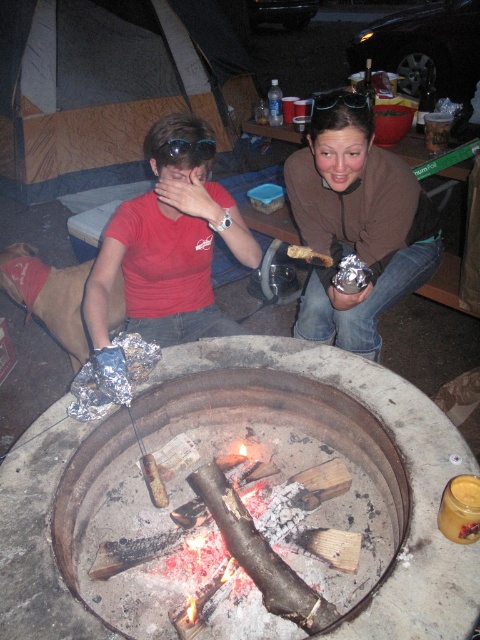
Question: Can you confirm if matte red shirt at center is positioned to the right of black plastic goggles at upper center?

Choices:
 (A) yes
 (B) no

Answer: (A)

Question: Is charcoal gray concrete fire pit at center above black fabric tent at upper left?

Choices:
 (A) no
 (B) yes

Answer: (A)

Question: Based on their relative distances, which object is farther from the black plastic goggles at upper center?

Choices:
 (A) matte brown sweater at center
 (B) matte red shirt at left
 (C) black fabric tent at upper left
 (D) charcoal gray concrete fire pit at center

Answer: (C)

Question: Which point is farther to the camera?

Choices:
 (A) (297, 452)
 (B) (396, 294)
 (C) (365, 102)

Answer: (B)

Question: Which point is farther to the camera?

Choices:
 (A) (323, 97)
 (B) (98, 120)
 (C) (361, 150)
 (D) (121, 604)

Answer: (B)

Question: Is matte red shirt at center bigger than matte red shirt at left?

Choices:
 (A) yes
 (B) no

Answer: (A)